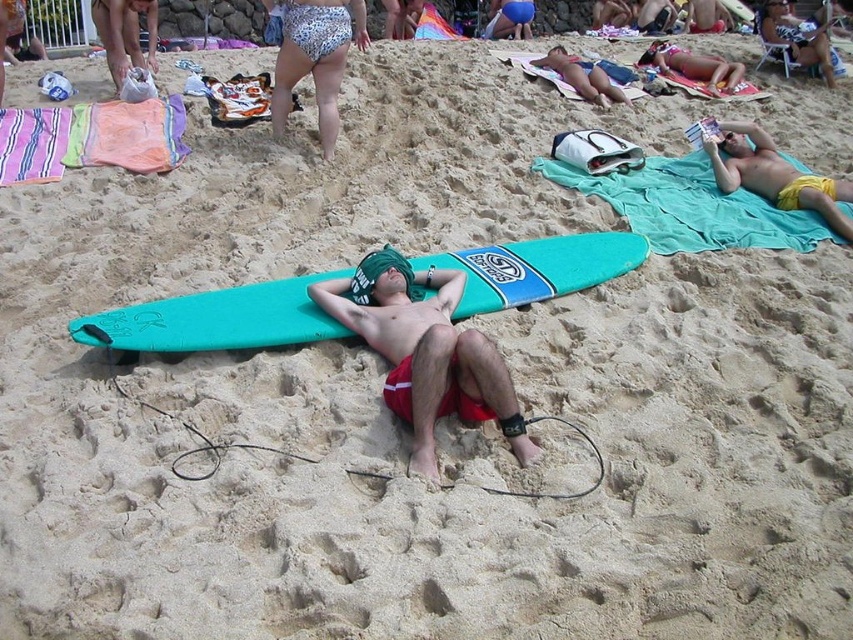
Is matte green towel at center to the left of teal fabric towel at upper right from the viewer's perspective?

Yes, matte green towel at center is to the left of teal fabric towel at upper right.

Does matte green towel at center have a greater height compared to teal fabric towel at upper right?

Correct, matte green towel at center is much taller as teal fabric towel at upper right.

Is point (405, 352) closer to camera compared to point (712, 179)?

Yes.

Find the location of a particular element. The width and height of the screenshot is (853, 640). matte green towel at center is located at coordinates (425, 352).

Measure the distance between matte yellow shorts at upper right and camera.

The distance of matte yellow shorts at upper right from camera is 9.08 meters.

Is matte yellow shorts at upper right closer to the viewer compared to matte green towel at upper right?

No, matte yellow shorts at upper right is behind matte green towel at upper right.

This screenshot has width=853, height=640. What do you see at coordinates (692, 65) in the screenshot?
I see `matte yellow shorts at upper right` at bounding box center [692, 65].

You are a GUI agent. You are given a task and a screenshot of the screen. Output one action in this format:
    pyautogui.click(x=<x>, y=<y>)
    Task: Click on the matte yellow shorts at upper right
    
    Given the screenshot: What is the action you would take?
    692,65

Which is above, matte green towel at center or matte green towel at upper right?

matte green towel at upper right

In the scene shown: Can you confirm if matte green towel at center is positioned to the left of matte green towel at upper right?

Yes, matte green towel at center is to the left of matte green towel at upper right.

Who is more forward, (432, 397) or (563, 49)?

Point (432, 397)

Find the location of a particular element. matte green towel at center is located at coordinates (425, 352).